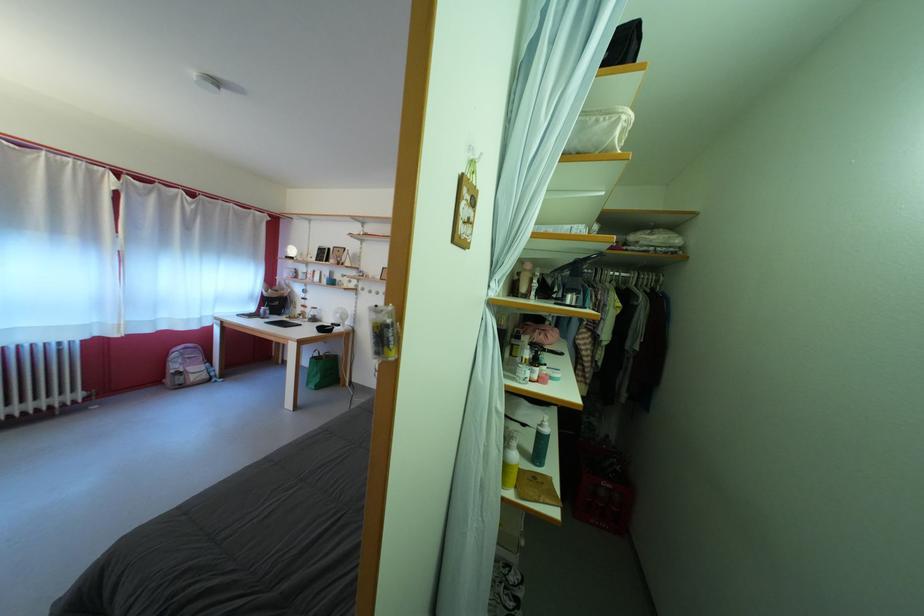
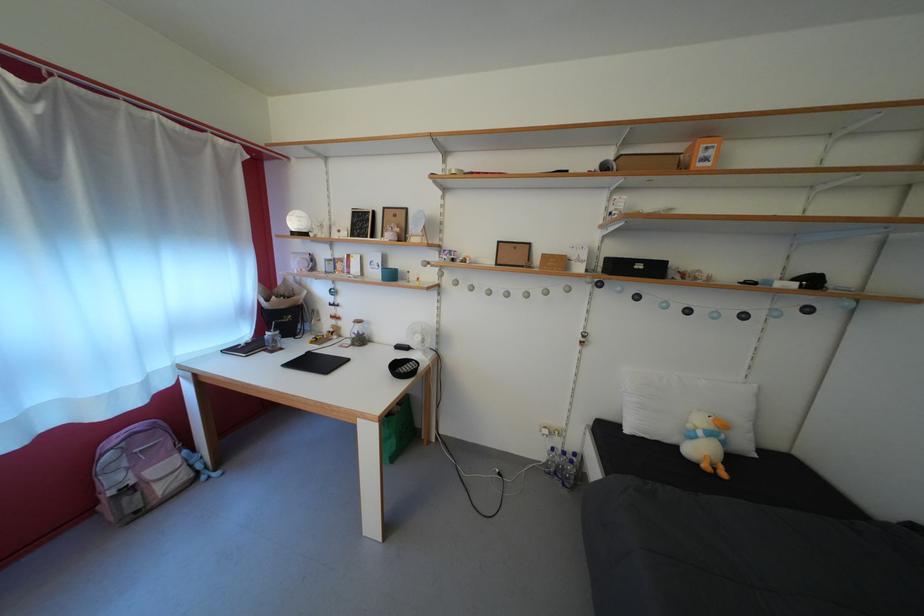
In a continuous first-person perspective shot, in which direction is the camera moving?

The cameraman moved toward left, forward.